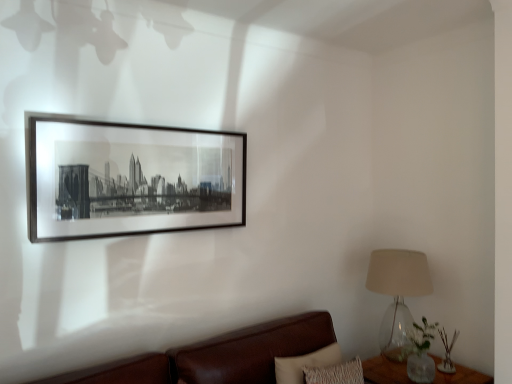
Question: Does brown leather couch at lower right have a larger size compared to clear glass table at lower right?

Choices:
 (A) yes
 (B) no

Answer: (A)

Question: From the image's perspective, is brown leather couch at lower right above clear glass table at lower right?

Choices:
 (A) no
 (B) yes

Answer: (B)

Question: From the image's perspective, would you say brown leather couch at lower right is shown under clear glass table at lower right?

Choices:
 (A) no
 (B) yes

Answer: (A)

Question: Is clear glass table at lower right inside brown leather couch at lower right?

Choices:
 (A) no
 (B) yes

Answer: (A)

Question: From a real-world perspective, is brown leather couch at lower right physically below clear glass table at lower right?

Choices:
 (A) no
 (B) yes

Answer: (A)

Question: Does brown leather couch at lower right have a lesser width compared to clear glass table at lower right?

Choices:
 (A) yes
 (B) no

Answer: (B)

Question: Considering the relative sizes of translucent glass lampshade at right and black matte picture frame at upper center in the image provided, is translucent glass lampshade at right thinner than black matte picture frame at upper center?

Choices:
 (A) yes
 (B) no

Answer: (B)

Question: Is translucent glass lampshade at right positioned behind black matte picture frame at upper center?

Choices:
 (A) yes
 (B) no

Answer: (A)

Question: Does translucent glass lampshade at right appear on the left side of black matte picture frame at upper center?

Choices:
 (A) yes
 (B) no

Answer: (B)

Question: Is translucent glass lampshade at right closer to camera compared to black matte picture frame at upper center?

Choices:
 (A) no
 (B) yes

Answer: (A)

Question: Does translucent glass lampshade at right contain black matte picture frame at upper center?

Choices:
 (A) no
 (B) yes

Answer: (A)

Question: Can you confirm if translucent glass lampshade at right is bigger than black matte picture frame at upper center?

Choices:
 (A) yes
 (B) no

Answer: (A)

Question: Can you confirm if black matte picture frame at upper center is shorter than green glass vase at lower right?

Choices:
 (A) no
 (B) yes

Answer: (A)